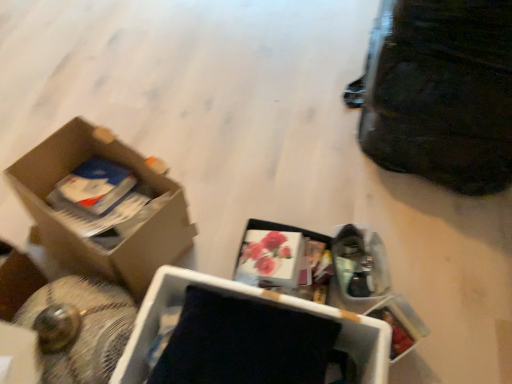
Image resolution: width=512 pixels, height=384 pixels. Describe the element at coordinates (87, 238) in the screenshot. I see `cardboard box at left, placed as the first box when sorted from left to right` at that location.

I want to click on cardboard box at left, placed as the first box when sorted from left to right, so click(x=87, y=238).

Which point is more forward, (166, 306) or (117, 279)?

Point (166, 306)

Is black matte box at center, which is the second box from left to right, positioned beyond the bounds of cardboard box at left, placed as the first box when sorted from left to right?

Yes.

In the scene shown: Which of these two, black matte box at center, which is the second box from left to right, or cardboard box at left, placed as the first box when sorted from left to right, stands taller?

Standing taller between the two is cardboard box at left, placed as the first box when sorted from left to right.

From a real-world perspective, relative to cardboard box at left, acting as the 2th box starting from the right, is black matte box at center, which is the second box from left to right, vertically above or below?

From a real-world perspective, black matte box at center, which is the second box from left to right, is physically below cardboard box at left, acting as the 2th box starting from the right.

Which object is wider, black matte box at center, acting as the first box starting from the right, or black leather bag at upper right?

black leather bag at upper right.

Consider the image. Which object is positioned more to the left, black matte box at center, which is the second box from left to right, or black leather bag at upper right?

black matte box at center, which is the second box from left to right.

Image resolution: width=512 pixels, height=384 pixels. I want to click on bag lying on the right of black matte box at center, which is the second box from left to right, so click(x=439, y=93).

Looking at the image, does black matte box at center, acting as the first box starting from the right, seem bigger or smaller compared to black leather bag at upper right?

black matte box at center, acting as the first box starting from the right, is smaller than black leather bag at upper right.

Is black leather bag at upper right far from black matte box at center, which is the second box from left to right?

black leather bag at upper right is near black matte box at center, which is the second box from left to right, not far away.

Is black leather bag at upper right oriented away from black matte box at center, which is the second box from left to right?

black leather bag at upper right does not have its back to black matte box at center, which is the second box from left to right.

Can you tell me how much black leather bag at upper right and black matte box at center, acting as the first box starting from the right, differ in facing direction?

They differ by 90.3 degrees in their facing directions.

Does black leather bag at upper right come in front of black matte box at center, acting as the first box starting from the right?

No, the depth of black leather bag at upper right is greater than that of black matte box at center, acting as the first box starting from the right.

Can you confirm if cardboard box at left, placed as the first box when sorted from left to right, is shorter than black matte box at center, acting as the first box starting from the right?

In fact, cardboard box at left, placed as the first box when sorted from left to right, may be taller than black matte box at center, acting as the first box starting from the right.

Can you tell me how much cardboard box at left, placed as the first box when sorted from left to right, and black matte box at center, which is the second box from left to right, differ in facing direction?

The facing directions of cardboard box at left, placed as the first box when sorted from left to right, and black matte box at center, which is the second box from left to right, are 22.2 degrees apart.

Find the location of a particular element. This screenshot has width=512, height=384. box behind the black matte box at center, acting as the first box starting from the right is located at coordinates (87, 238).

From a real-world perspective, which object rests below the other?

From a 3D spatial view, cardboard box at left, acting as the 2th box starting from the right, is below.

Considering the relative sizes of cardboard box at left, acting as the 2th box starting from the right, and black leather bag at upper right in the image provided, is cardboard box at left, acting as the 2th box starting from the right, wider than black leather bag at upper right?

No, cardboard box at left, acting as the 2th box starting from the right, is not wider than black leather bag at upper right.

Which object is more forward, cardboard box at left, acting as the 2th box starting from the right, or black leather bag at upper right?

black leather bag at upper right is more forward.

From the image's perspective, which is above, cardboard box at left, acting as the 2th box starting from the right, or black leather bag at upper right?

From the image's view, black leather bag at upper right is above.

Which object is more forward, black leather bag at upper right or cardboard box at left, acting as the 2th box starting from the right?

black leather bag at upper right is closer to the camera.

Are black leather bag at upper right and cardboard box at left, placed as the first box when sorted from left to right, located far from each other?

No, black leather bag at upper right is not far from cardboard box at left, placed as the first box when sorted from left to right.

In the scene shown: Does black leather bag at upper right have a lesser height compared to cardboard box at left, placed as the first box when sorted from left to right?

In fact, black leather bag at upper right may be taller than cardboard box at left, placed as the first box when sorted from left to right.

From a real-world perspective, between black leather bag at upper right and cardboard box at left, placed as the first box when sorted from left to right, who is vertically lower?

In real-world perspective, cardboard box at left, placed as the first box when sorted from left to right, is lower.

This screenshot has height=384, width=512. Identify the location of box that is above the black matte box at center, which is the second box from left to right (from the image's perspective). pos(87,238).

From the image's perspective, which box is the 2nd one below the black leather bag at upper right? Please provide its 2D coordinates.

[(243, 336)]

Estimate the real-world distances between objects in this image. Which object is further from black leather bag at upper right, black matte box at center, acting as the first box starting from the right, or cardboard box at left, acting as the 2th box starting from the right?

cardboard box at left, acting as the 2th box starting from the right, is further to black leather bag at upper right.

Looking at this image, estimate the real-world distances between objects in this image. Which object is closer to cardboard box at left, acting as the 2th box starting from the right, black leather bag at upper right or black matte box at center, which is the second box from left to right?

black matte box at center, which is the second box from left to right, is closer to cardboard box at left, acting as the 2th box starting from the right.

Consider the image. When comparing their distances from black matte box at center, acting as the first box starting from the right, does cardboard box at left, placed as the first box when sorted from left to right, or black leather bag at upper right seem further?

Among the two, black leather bag at upper right is located further to black matte box at center, acting as the first box starting from the right.

Based on their spatial positions, is black leather bag at upper right or cardboard box at left, acting as the 2th box starting from the right, further from black matte box at center, which is the second box from left to right?

black leather bag at upper right is positioned further to the anchor black matte box at center, which is the second box from left to right.

Which object lies nearer to the anchor point black leather bag at upper right, cardboard box at left, acting as the 2th box starting from the right, or black matte box at center, which is the second box from left to right?

black matte box at center, which is the second box from left to right, lies closer to black leather bag at upper right than the other object.

From the image, which object appears to be farther from cardboard box at left, placed as the first box when sorted from left to right, black matte box at center, acting as the first box starting from the right, or black leather bag at upper right?

black leather bag at upper right lies further to cardboard box at left, placed as the first box when sorted from left to right, than the other object.

This screenshot has width=512, height=384. Identify the location of box situated between cardboard box at left, placed as the first box when sorted from left to right, and black leather bag at upper right from left to right. click(243, 336).